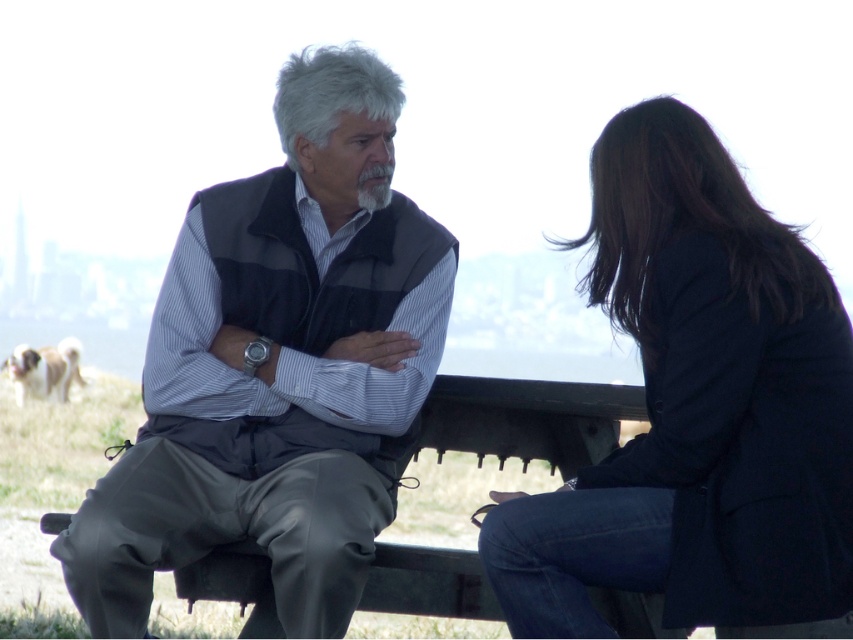
Can you confirm if gray fabric vest at center is shorter than dark blue blazer at right?

No, gray fabric vest at center is not shorter than dark blue blazer at right.

This screenshot has height=640, width=853. I want to click on gray fabric vest at center, so click(x=279, y=369).

Is point (148, 401) less distant than point (805, 392)?

No.

What are the coordinates of `gray fabric vest at center` in the screenshot? It's located at (279, 369).

Can you confirm if dark blue blazer at right is smaller than fluffy beige dog at lower left?

Yes.

Does dark blue blazer at right appear on the left side of fluffy beige dog at lower left?

No, dark blue blazer at right is not to the left of fluffy beige dog at lower left.

Which is in front, point (788, 314) or point (13, 369)?

Point (788, 314)

Locate an element on the screen. dark blue blazer at right is located at coordinates tap(695, 408).

Who is more forward, [273,362] or [39,349]?

Positioned in front is point [273,362].

Can you confirm if gray fabric vest at center is smaller than fluffy beige dog at lower left?

Yes.

Does point (285, 173) come behind point (59, 371)?

That is False.

Find the location of a particular element. The height and width of the screenshot is (640, 853). gray fabric vest at center is located at coordinates (279, 369).